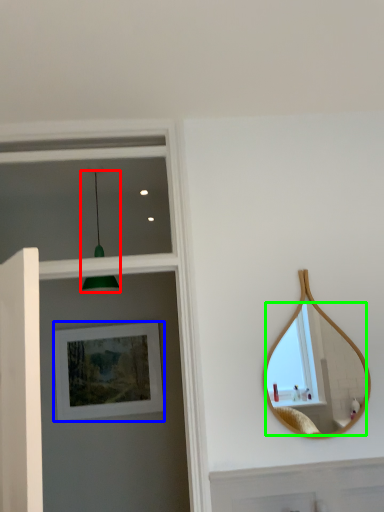
Question: Which object is positioned farthest from light fixture (highlighted by a red box)? Select from picture frame (highlighted by a blue box) and mirror (highlighted by a green box).

Choices:
 (A) picture frame
 (B) mirror

Answer: (B)